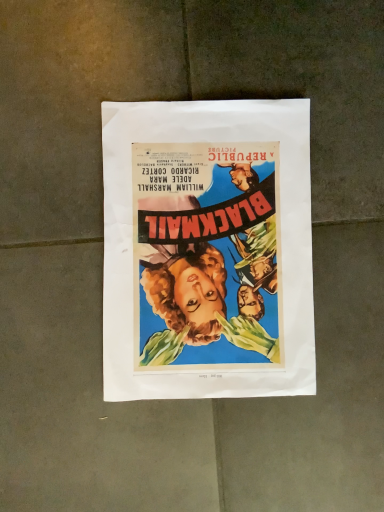
Question: Should I look upward or downward to see matte paper poster at center?

Choices:
 (A) down
 (B) up

Answer: (B)